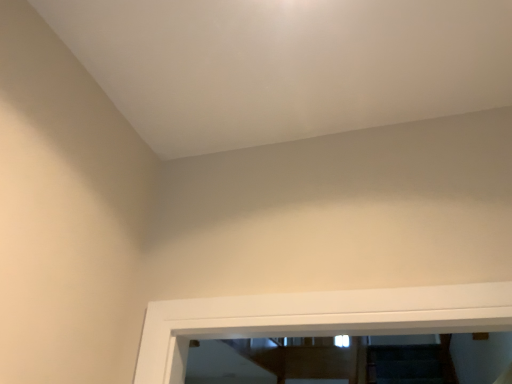
Find the location of `dark blue fabric stairs at lower center`. dark blue fabric stairs at lower center is located at coordinates (410, 365).

What do you see at coordinates (410, 365) in the screenshot? This screenshot has height=384, width=512. I see `dark blue fabric stairs at lower center` at bounding box center [410, 365].

The image size is (512, 384). In order to click on dark blue fabric stairs at lower center in this screenshot , I will do click(x=410, y=365).